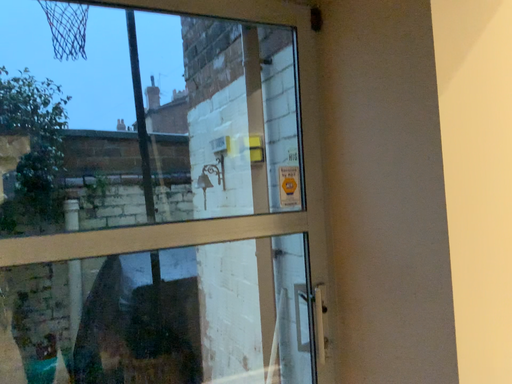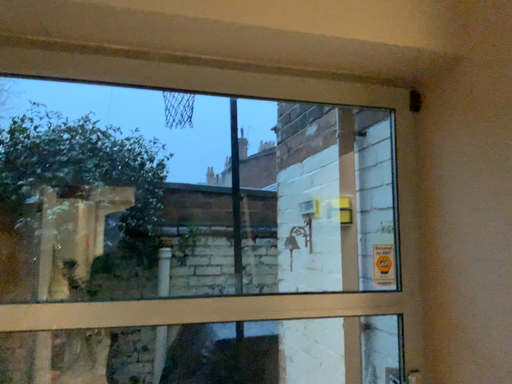
Question: Which way did the camera rotate in the video?

Choices:
 (A) rotated right
 (B) rotated left

Answer: (B)